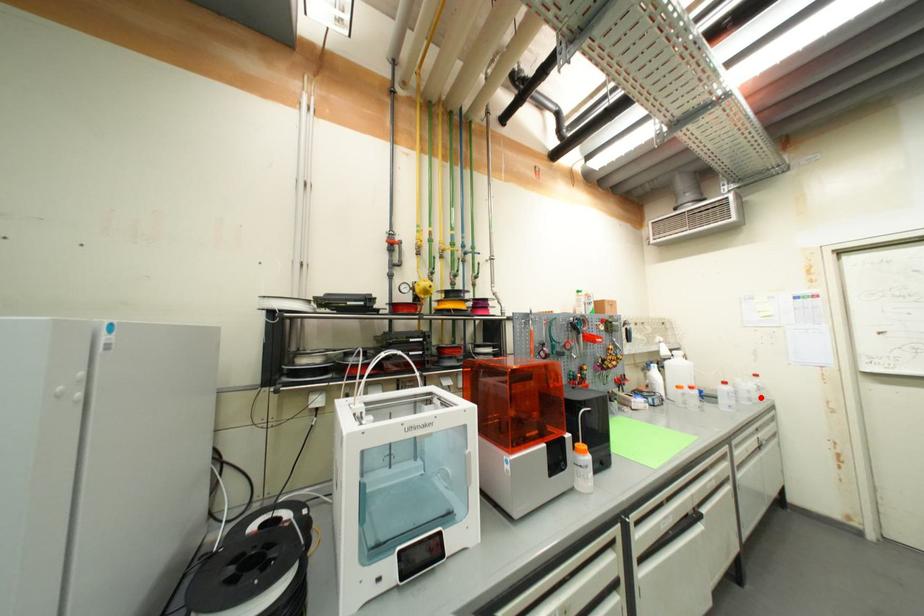
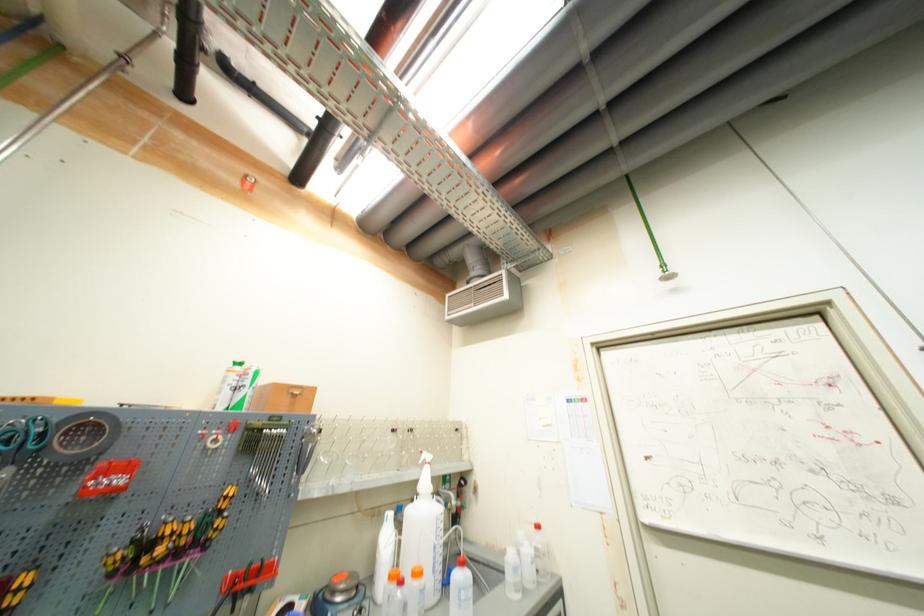
The point at the highlighted location is marked in the first image. Where is the corresponding point in the second image?

(533, 578)